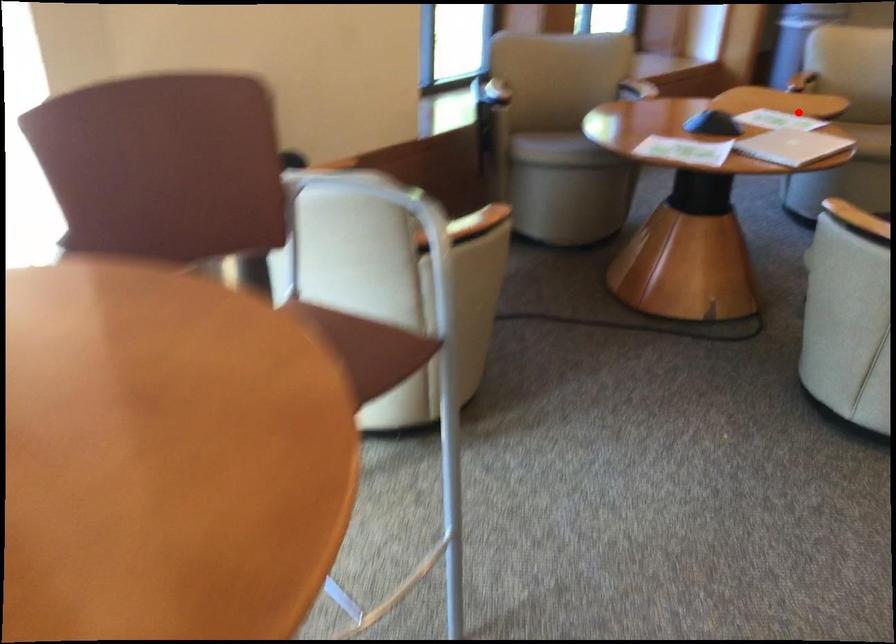
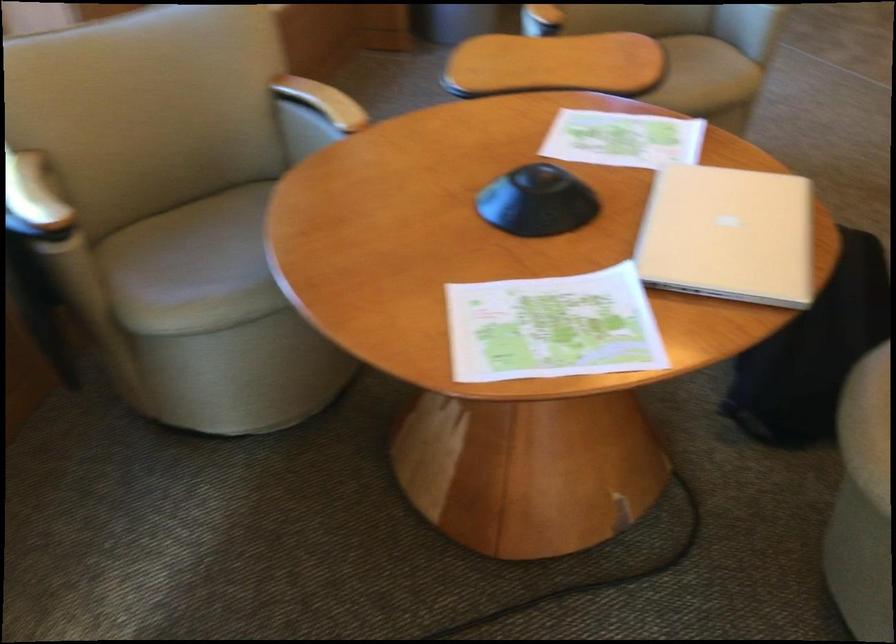
Where in the second image is the point corresponding to the highlighted location from the first image?

(623, 138)